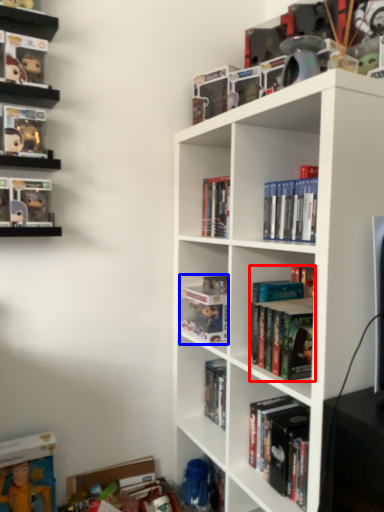
Question: Among these objects, which one is farthest to the camera, book (highlighted by a red box) or book (highlighted by a blue box)?

Choices:
 (A) book
 (B) book

Answer: (B)